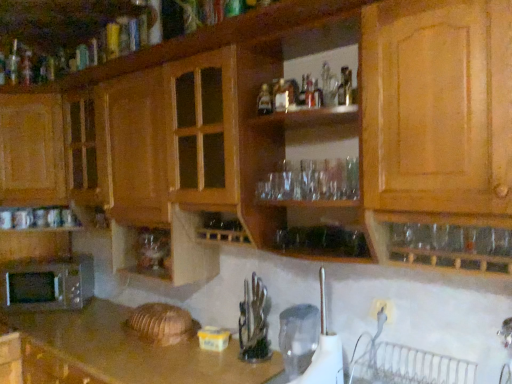
Question: Is the position of wooden cabinet at upper center, arranged as the 1th cabinetry when viewed from the top, more distant than that of white plastic kettle at lower center, which is the second appliance in back-to-front order?

Choices:
 (A) yes
 (B) no

Answer: (B)

Question: Is wooden cabinet at upper center, arranged as the 1th cabinetry when viewed from the top, looking in the opposite direction of white plastic kettle at lower center, which is the second appliance in back-to-front order?

Choices:
 (A) yes
 (B) no

Answer: (B)

Question: From a real-world perspective, is wooden cabinet at upper center, arranged as the 1th cabinetry when viewed from the top, beneath white plastic kettle at lower center, which is counted as the 1th appliance, starting from the front?

Choices:
 (A) yes
 (B) no

Answer: (B)

Question: Does wooden cabinet at upper center, arranged as the 3th cabinetry when ordered from the bottom, touch white plastic kettle at lower center, which is counted as the 1th appliance, starting from the front?

Choices:
 (A) yes
 (B) no

Answer: (B)

Question: Is wooden cabinet at upper center, arranged as the 3th cabinetry when ordered from the bottom, smaller than white plastic kettle at lower center, which is the second appliance in back-to-front order?

Choices:
 (A) yes
 (B) no

Answer: (B)

Question: From a real-world perspective, is wooden cabinet at upper center, arranged as the 1th cabinetry when viewed from the top, above or below clear glass bottle at upper center, which appears as the first bottle when viewed from the front?

Choices:
 (A) below
 (B) above

Answer: (B)

Question: Based on their sizes in the image, would you say wooden cabinet at upper center, arranged as the 1th cabinetry when viewed from the top, is bigger or smaller than clear glass bottle at upper center, which is counted as the 2th bottle, starting from the left?

Choices:
 (A) big
 (B) small

Answer: (A)

Question: Relative to clear glass bottle at upper center, placed as the second bottle when sorted from back to front, is wooden cabinet at upper center, arranged as the 1th cabinetry when viewed from the top, in front or behind?

Choices:
 (A) front
 (B) behind

Answer: (A)

Question: From the image's perspective, is wooden cabinet at upper center, arranged as the 1th cabinetry when viewed from the top, positioned above or below clear glass bottle at upper center, which is counted as the 2th bottle, starting from the left?

Choices:
 (A) below
 (B) above

Answer: (B)

Question: Is wooden cabinet at upper center, arranged as the 1th cabinetry when viewed from the top, taller or shorter than wooden cabinet at left, which ranks as the 2th cabinetry in bottom-to-top order?

Choices:
 (A) short
 (B) tall

Answer: (A)

Question: Based on their sizes in the image, would you say wooden cabinet at upper center, arranged as the 1th cabinetry when viewed from the top, is bigger or smaller than wooden cabinet at left, the 2th cabinetry in the top-to-bottom sequence?

Choices:
 (A) big
 (B) small

Answer: (B)

Question: From the image's perspective, is wooden cabinet at upper center, arranged as the 3th cabinetry when ordered from the bottom, located above or below wooden cabinet at left, the 2th cabinetry in the top-to-bottom sequence?

Choices:
 (A) below
 (B) above

Answer: (B)

Question: Is wooden cabinet at upper center, arranged as the 1th cabinetry when viewed from the top, inside or outside of wooden cabinet at left, which ranks as the 2th cabinetry in bottom-to-top order?

Choices:
 (A) outside
 (B) inside

Answer: (A)

Question: From a real-world perspective, is transparent plastic pitcher at lower center, arranged as the 1th appliance when viewed from the back, positioned above or below clear glass bottle at upper center, which appears as the first bottle when viewed from the front?

Choices:
 (A) below
 (B) above

Answer: (A)

Question: From the image's perspective, relative to clear glass bottle at upper center, which appears as the first bottle when viewed from the front, is transparent plastic pitcher at lower center, which is the second appliance from front to back, above or below?

Choices:
 (A) above
 (B) below

Answer: (B)